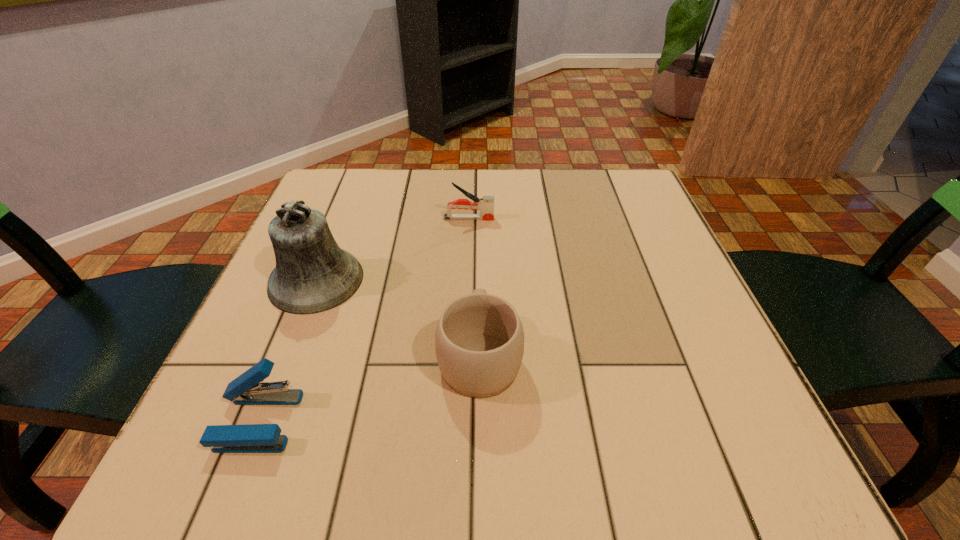
Image resolution: width=960 pixels, height=540 pixels. In the image, there is a desktop. What are the coordinates of `free space at the right edge` in the screenshot? It's located at (652, 262).

Where is `vacant area at the near left corner`? The image size is (960, 540). vacant area at the near left corner is located at coordinates (252, 467).

The image size is (960, 540). In the image, there is a desktop. Find the location of `vacant space at the near right corner`. vacant space at the near right corner is located at coordinates (x=669, y=426).

Find the location of `unoccupied area between the farthest object and the second farthest object`. unoccupied area between the farthest object and the second farthest object is located at coordinates (393, 249).

The image size is (960, 540). I want to click on free space that is in between the farthest object and the left stapler, so click(x=364, y=320).

The height and width of the screenshot is (540, 960). I want to click on empty space that is in between the mug and the left stapler, so click(369, 388).

Locate an element on the screen. Image resolution: width=960 pixels, height=540 pixels. free space between the nearer stapler and the farther stapler is located at coordinates 364,320.

The width and height of the screenshot is (960, 540). Find the location of `vacant area that lies between the farthest object and the nearer stapler`. vacant area that lies between the farthest object and the nearer stapler is located at coordinates (364, 320).

This screenshot has width=960, height=540. Find the location of `vacant space that's between the nearer stapler and the mug`. vacant space that's between the nearer stapler and the mug is located at coordinates (369, 388).

This screenshot has width=960, height=540. Find the location of `free space between the nearer stapler and the second farthest object`. free space between the nearer stapler and the second farthest object is located at coordinates (287, 350).